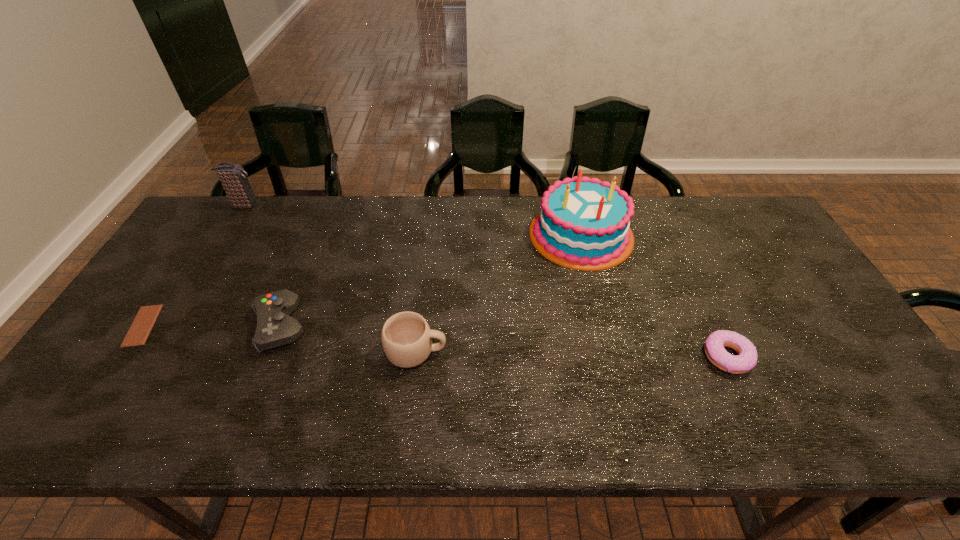
I want to click on object that is at the far left corner, so click(x=233, y=177).

I want to click on free space at the far edge of the desktop, so click(652, 206).

This screenshot has width=960, height=540. In the image, there is a desktop. Identify the location of free region at the near edge. (751, 412).

Where is `vacant space at the left edge`? The width and height of the screenshot is (960, 540). vacant space at the left edge is located at coordinates (137, 362).

In the image, there is a desktop. At what (x,y) coordinates should I click in order to perform the action: click on free region at the right edge. Please return your answer as a coordinate pair (x, y). The height and width of the screenshot is (540, 960). Looking at the image, I should click on (791, 310).

The image size is (960, 540). I want to click on free location at the far left corner of the desktop, so click(228, 222).

Where is `free point between the clutch bag and the chocolate bar`? The width and height of the screenshot is (960, 540). free point between the clutch bag and the chocolate bar is located at coordinates (193, 265).

Identify the location of free space between the doughnut and the fourth object from right to left. (504, 341).

Identify the location of free space between the mug and the fifth shortest object. (330, 278).

You are a GUI agent. You are given a task and a screenshot of the screen. Output one action in this format:
    pyautogui.click(x=<x>, y=<y>)
    Task: Click on the vacant space in between the shortest object and the fifth tallest object
    Image resolution: width=960 pixels, height=540 pixels.
    Given the screenshot: What is the action you would take?
    pyautogui.click(x=435, y=341)